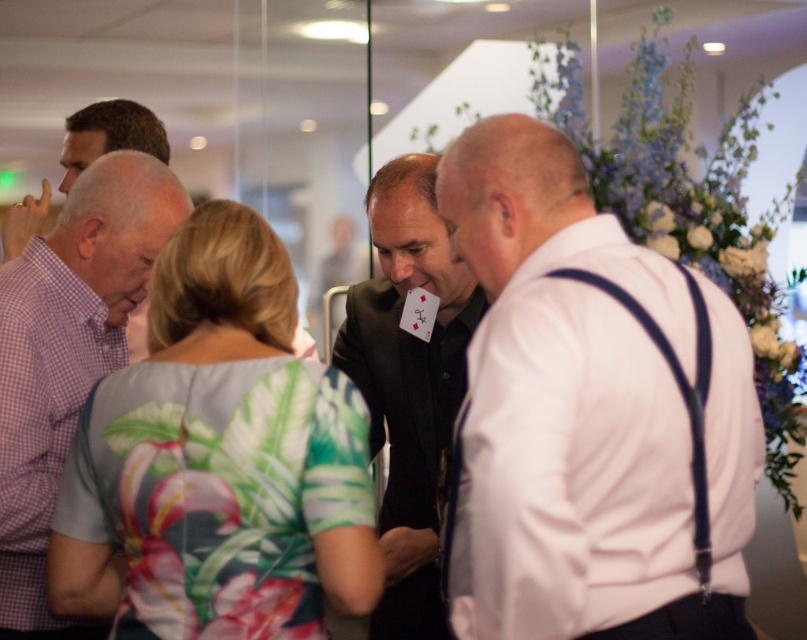
This screenshot has height=640, width=807. Describe the element at coordinates (222, 458) in the screenshot. I see `floral print dress at center` at that location.

Who is positioned more to the left, floral print dress at center or black matte suit at center?

Positioned to the left is floral print dress at center.

What do you see at coordinates (222, 458) in the screenshot? Image resolution: width=807 pixels, height=640 pixels. I see `floral print dress at center` at bounding box center [222, 458].

This screenshot has width=807, height=640. Identify the location of floral print dress at center. point(222,458).

Who is more distant from viewer, (x=498, y=566) or (x=136, y=115)?

Point (x=136, y=115)

Which is in front, point (741, 355) or point (6, 260)?

Point (741, 355) is in front.

This screenshot has height=640, width=807. Identify the location of white matte shirt at right. coord(586,413).

Where is `white matte shirt at right`? white matte shirt at right is located at coordinates (586, 413).

This screenshot has height=640, width=807. Describe the element at coordinates (586, 413) in the screenshot. I see `white matte shirt at right` at that location.

Between white matte shirt at right and black matte suit at center, which one is positioned lower?

black matte suit at center is lower down.

Does point (483, 532) come in front of point (416, 566)?

Yes.

I want to click on white matte shirt at right, so click(x=586, y=413).